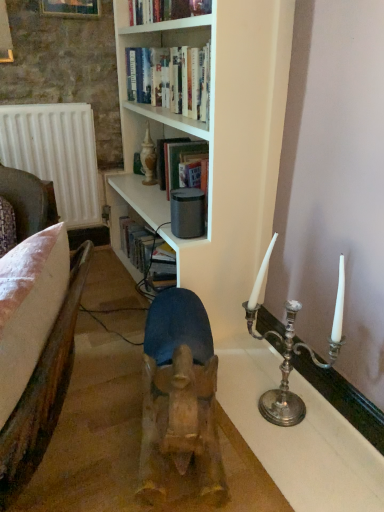
Question: Can you confirm if white matte bookshelf at upper center is smaller than hardcover book at upper center?

Choices:
 (A) yes
 (B) no

Answer: (B)

Question: From the image's perspective, would you say white matte bookshelf at upper center is shown under hardcover book at upper center?

Choices:
 (A) yes
 (B) no

Answer: (A)

Question: From the image's perspective, is white matte bookshelf at upper center located above hardcover book at upper center?

Choices:
 (A) no
 (B) yes

Answer: (A)

Question: Is white matte bookshelf at upper center outside hardcover book at upper center?

Choices:
 (A) yes
 (B) no

Answer: (A)

Question: Considering the relative sizes of white matte bookshelf at upper center and hardcover book at upper center in the image provided, is white matte bookshelf at upper center thinner than hardcover book at upper center?

Choices:
 (A) no
 (B) yes

Answer: (A)

Question: Can you confirm if white matte bookshelf at upper center is bigger than hardcover book at upper center?

Choices:
 (A) yes
 (B) no

Answer: (A)

Question: Is white matte bookshelf at upper center a part of brown leather armchair at left?

Choices:
 (A) yes
 (B) no

Answer: (B)

Question: Is brown leather armchair at left oriented away from white matte bookshelf at upper center?

Choices:
 (A) no
 (B) yes

Answer: (A)

Question: Is brown leather armchair at left in front of white matte bookshelf at upper center?

Choices:
 (A) no
 (B) yes

Answer: (B)

Question: Is brown leather armchair at left to the right of white matte bookshelf at upper center from the viewer's perspective?

Choices:
 (A) yes
 (B) no

Answer: (B)

Question: Is brown leather armchair at left shorter than white matte bookshelf at upper center?

Choices:
 (A) no
 (B) yes

Answer: (B)

Question: Considering the relative sizes of brown leather armchair at left and white matte bookshelf at upper center in the image provided, is brown leather armchair at left thinner than white matte bookshelf at upper center?

Choices:
 (A) yes
 (B) no

Answer: (A)

Question: Can you confirm if brown leather armchair at left is bigger than wooden frame at upper left?

Choices:
 (A) yes
 (B) no

Answer: (A)